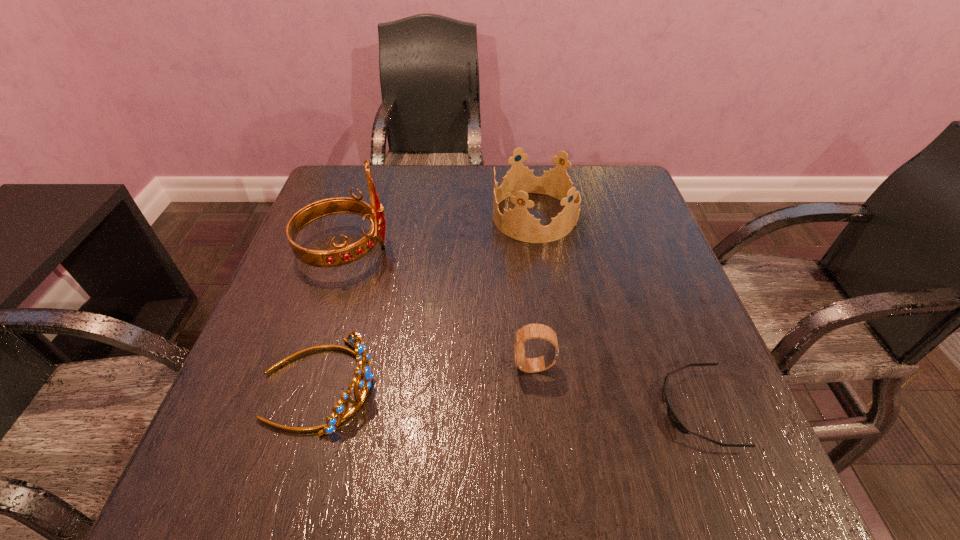
At what (x,y) coordinates should I click in order to perform the action: click on blank space located on the front-facing side of the fourth shortest object. Please return your answer as a coordinate pair (x, y). Looking at the image, I should click on coord(468,217).

What are the coordinates of `free space located 0.060m on the front-facing side of the shortest tiara` in the screenshot? It's located at (409, 385).

Locate an element on the screen. The width and height of the screenshot is (960, 540). free space located on the face of the watch is located at coordinates (316, 367).

Image resolution: width=960 pixels, height=540 pixels. What are the coordinates of `vacant space positioned 0.210m on the face of the watch` in the screenshot? It's located at (398, 367).

What are the coordinates of `blank space located 0.190m on the face of the watch` in the screenshot? It's located at 409,367.

Identify the location of free space located 0.380m on the front-facing side of the sunglasses. (438, 408).

Locate an element on the screen. The height and width of the screenshot is (540, 960). vacant space situated on the front-facing side of the sunglasses is located at coordinates (568, 408).

Image resolution: width=960 pixels, height=540 pixels. I want to click on vacant space situated 0.280m on the front-facing side of the sunglasses, so click(x=497, y=408).

At what (x,y) coordinates should I click in order to perform the action: click on object that is at the far edge. Please return your answer as a coordinate pair (x, y). The height and width of the screenshot is (540, 960). Looking at the image, I should click on (517, 223).

At what (x,y) coordinates should I click in order to perform the action: click on object that is at the near edge. Please return your answer as a coordinate pair (x, y). The width and height of the screenshot is (960, 540). Looking at the image, I should click on (671, 414).